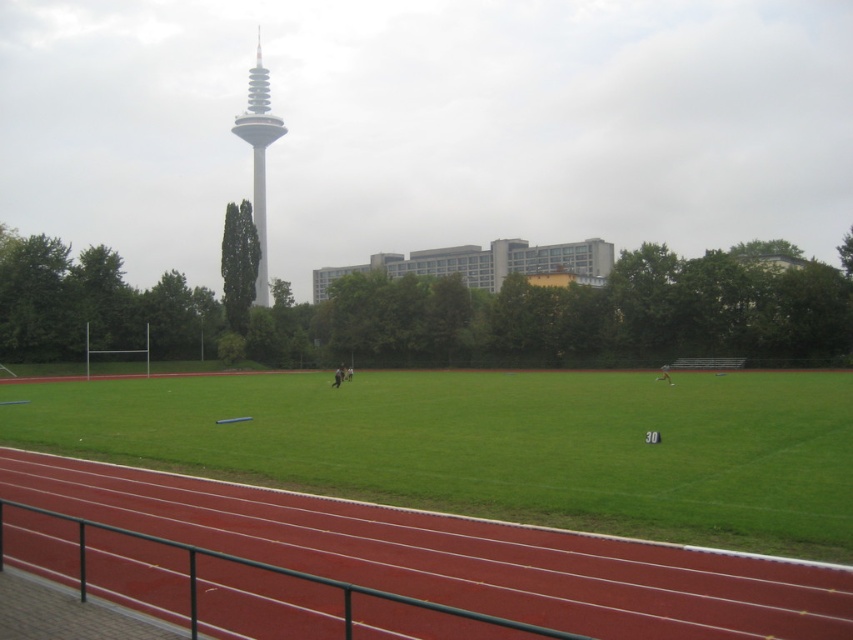
Question: Which point is farther to the camera?

Choices:
 (A) green grass at center
 (B) white smooth tower at upper center
 (C) rubberized red track at lower left

Answer: (B)

Question: Is green grass at center smaller than white smooth tower at upper center?

Choices:
 (A) no
 (B) yes

Answer: (B)

Question: Among these points, which one is nearest to the camera?

Choices:
 (A) (722, 381)
 (B) (257, 58)

Answer: (A)

Question: Can you confirm if green grass at center is smaller than rubberized red track at lower left?

Choices:
 (A) no
 (B) yes

Answer: (A)

Question: Can you confirm if green grass at center is positioned to the right of rubberized red track at lower left?

Choices:
 (A) yes
 (B) no

Answer: (A)

Question: Which point is farther to the camera?

Choices:
 (A) rubberized red track at lower left
 (B) green grass at center
 (C) white smooth tower at upper center

Answer: (C)